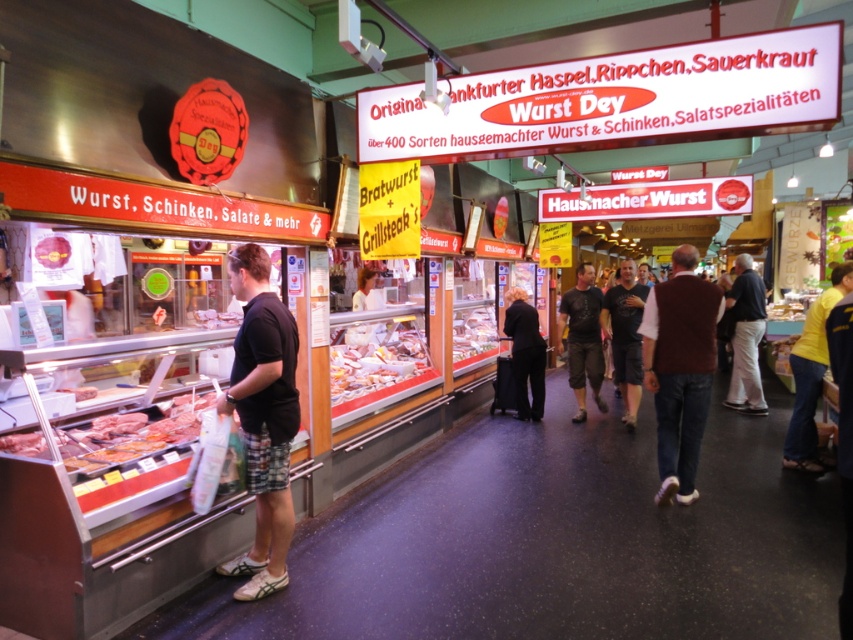
You are a customer in the market and want to buy some fresh vegetables. You see a point marked at coordinates (132, 433). Is this point on a vegetable or on raw meat?

The point at coordinates (132, 433) is on raw meat at lower left.

You are a customer in the market and want to pick up both the brown sweater at center and the shiny plastic meat at center. What is the minimum distance you need to walk to collect both items?

The minimum distance you need to walk to collect both items is 2.75 meters, as the brown sweater at center is 2.75 meters away from the shiny plastic meat at center.

You are a customer in the market and want to pick up both the raw meat at lower left and the matte plastic deli meat at center. Which item should you reach for first to avoid contamination?

You should reach for the raw meat at lower left first because it is closer to you, minimizing the risk of contaminating the matte plastic deli meat at center which is further away.